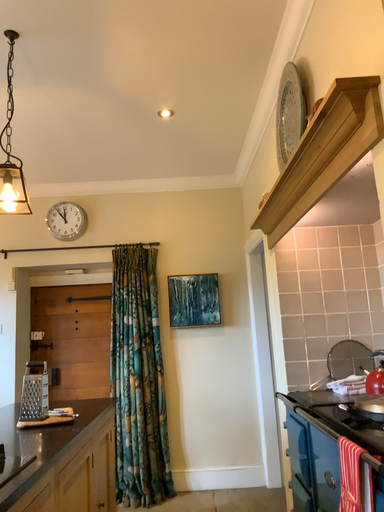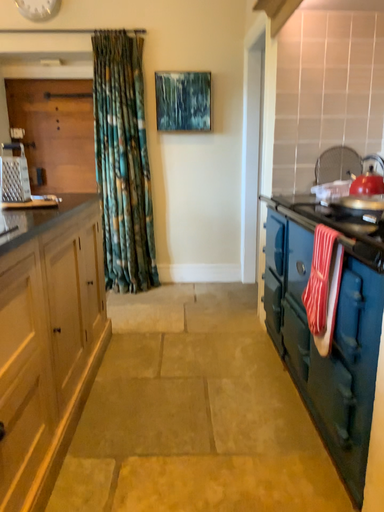
Question: Which way did the camera rotate in the video?

Choices:
 (A) rotated downward
 (B) rotated upward

Answer: (A)